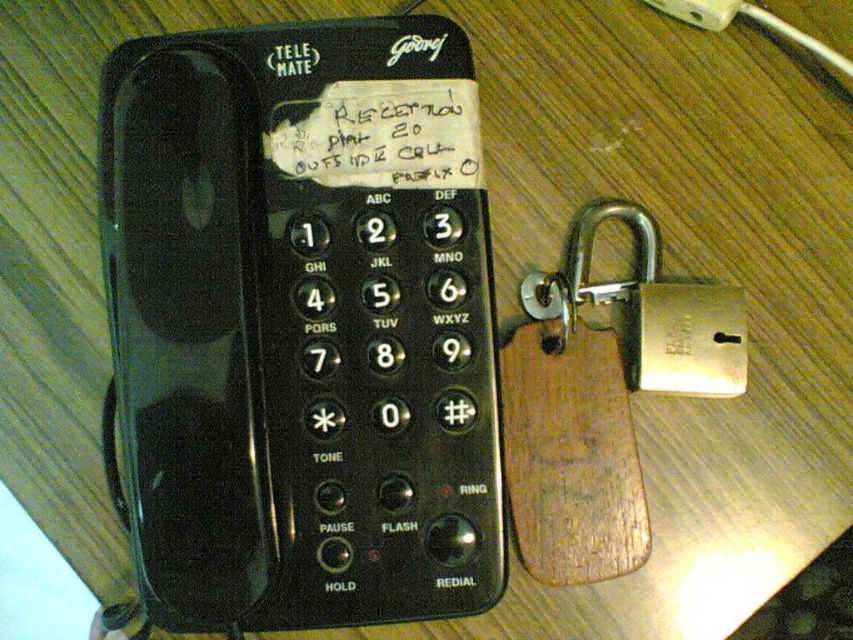
How distant is black plastic telephone at center from white paper at center?

black plastic telephone at center is 6.11 inches from white paper at center.

Consider the image. Who is taller, black plastic telephone at center or white paper at center?

Standing taller between the two is black plastic telephone at center.

Between point (442, 310) and point (469, 81), which one is positioned in front?

Point (469, 81) is more forward.

Locate an element on the screen. This screenshot has width=853, height=640. black plastic telephone at center is located at coordinates (302, 324).

Can you confirm if white paper at center is thinner than white plastic plug at upper right?

No.

Image resolution: width=853 pixels, height=640 pixels. I want to click on white paper at center, so click(x=384, y=134).

Can you confirm if black plastic telephone at center is taller than white plastic plug at upper right?

Indeed, black plastic telephone at center has a greater height compared to white plastic plug at upper right.

The image size is (853, 640). What do you see at coordinates (302, 324) in the screenshot?
I see `black plastic telephone at center` at bounding box center [302, 324].

Is point (460, 310) positioned behind point (740, 8)?

No, (460, 310) is closer to viewer.

I want to click on black plastic telephone at center, so click(x=302, y=324).